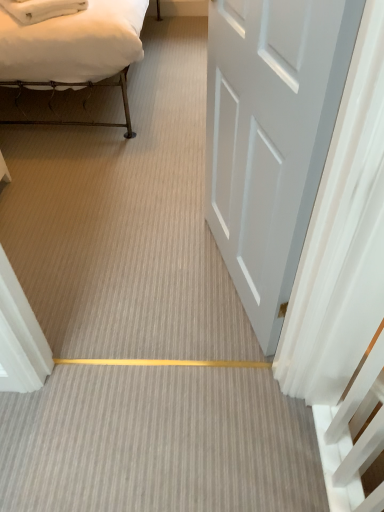
Question: From the image's perspective, is white cotton bed at upper left positioned above or below white glossy door at center?

Choices:
 (A) above
 (B) below

Answer: (A)

Question: Relative to white glossy door at center, is white cotton bed at upper left in front or behind?

Choices:
 (A) behind
 (B) front

Answer: (A)

Question: Considering the positions of white cotton bed at upper left and white glossy door at center in the image, is white cotton bed at upper left wider or thinner than white glossy door at center?

Choices:
 (A) wide
 (B) thin

Answer: (A)

Question: Is white glossy door at center taller or shorter than white cotton bed at upper left?

Choices:
 (A) tall
 (B) short

Answer: (A)

Question: From a real-world perspective, is white glossy door at center above or below white cotton bed at upper left?

Choices:
 (A) below
 (B) above

Answer: (B)

Question: Would you say white glossy door at center is to the left or to the right of white cotton bed at upper left in the picture?

Choices:
 (A) left
 (B) right

Answer: (B)

Question: In terms of width, does white glossy door at center look wider or thinner when compared to white cotton bed at upper left?

Choices:
 (A) thin
 (B) wide

Answer: (A)